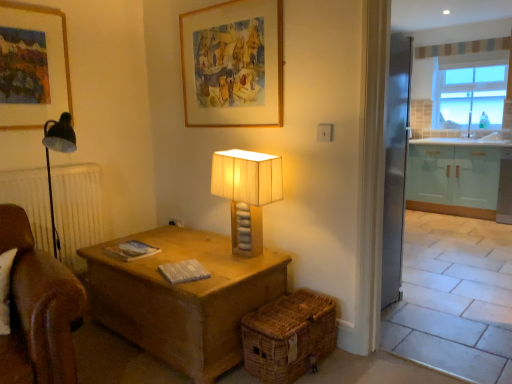
You are a GUI agent. You are given a task and a screenshot of the screen. Output one action in this format:
    pyautogui.click(x=<x>, y=<y>)
    Task: Click on the empty space that is to the right of woven brown basket at lower center
    This screenshot has width=512, height=384.
    Given the screenshot: What is the action you would take?
    pyautogui.click(x=360, y=369)